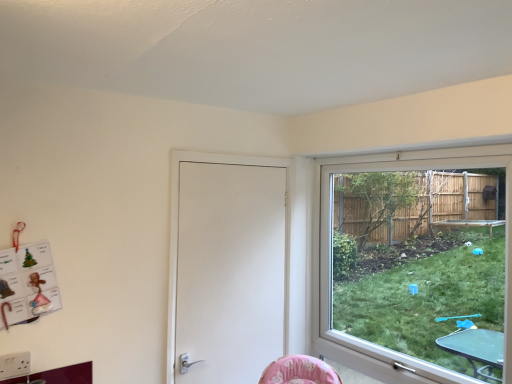
Question: From a real-world perspective, relative to white matte door at center, is clear glass window at right vertically above or below?

Choices:
 (A) below
 (B) above

Answer: (B)

Question: Considering the positions of clear glass window at right and white matte door at center in the image, is clear glass window at right taller or shorter than white matte door at center?

Choices:
 (A) short
 (B) tall

Answer: (B)

Question: Is point click(350, 271) closer or farther from the camera than point click(173, 215)?

Choices:
 (A) closer
 (B) farther

Answer: (B)

Question: Relative to clear glass window at right, is white matte door at center in front or behind?

Choices:
 (A) front
 (B) behind

Answer: (B)

Question: Considering the relative positions of white matte door at center and clear glass window at right in the image provided, is white matte door at center to the left or to the right of clear glass window at right?

Choices:
 (A) left
 (B) right

Answer: (A)

Question: From their relative heights in the image, would you say white matte door at center is taller or shorter than clear glass window at right?

Choices:
 (A) tall
 (B) short

Answer: (B)

Question: Considering the positions of white matte door at center and clear glass window at right in the image, is white matte door at center wider or thinner than clear glass window at right?

Choices:
 (A) wide
 (B) thin

Answer: (B)